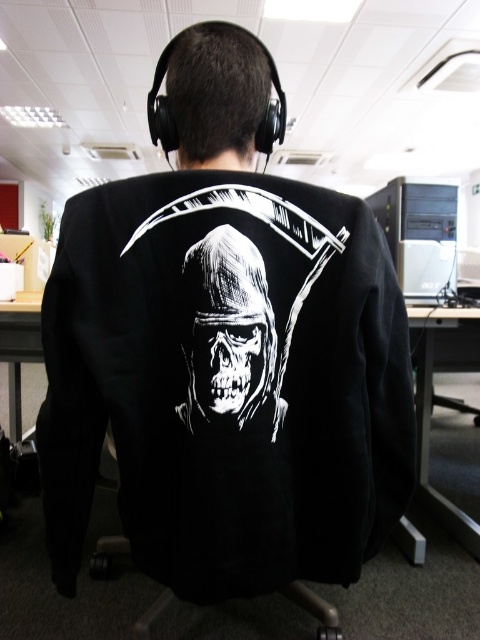
Can you confirm if black matte jacket at center is bigger than black plastic computer tower at right?

Incorrect, black matte jacket at center is not larger than black plastic computer tower at right.

Between point (72, 512) and point (380, 209), which one is positioned in front?

Point (72, 512) is more forward.

Locate an element on the screen. The image size is (480, 640). black matte jacket at center is located at coordinates (225, 356).

At what (x,y) coordinates should I click in order to perform the action: click on black matte jacket at center. Please return your answer as a coordinate pair (x, y). This screenshot has height=640, width=480. Looking at the image, I should click on (225, 356).

Between point (187, 355) and point (236, 355), which one is positioned in front?

Positioned in front is point (236, 355).

Is point (236, 397) closer to camera compared to point (195, 392)?

Yes, point (236, 397) is closer to viewer.

Between point (255, 276) and point (182, 308), which one is positioned in front?

Point (255, 276) is more forward.

Find the location of a particular element. The height and width of the screenshot is (640, 480). black matte jacket at center is located at coordinates (225, 356).

Who is taller, white glossy skull at center or black plastic computer tower at right?

With more height is black plastic computer tower at right.

In the scene shown: Is the position of white glossy skull at center less distant than that of black plastic computer tower at right?

Yes, white glossy skull at center is in front of black plastic computer tower at right.

The height and width of the screenshot is (640, 480). What do you see at coordinates (228, 333) in the screenshot?
I see `white glossy skull at center` at bounding box center [228, 333].

The width and height of the screenshot is (480, 640). Identify the location of white glossy skull at center. (228, 333).